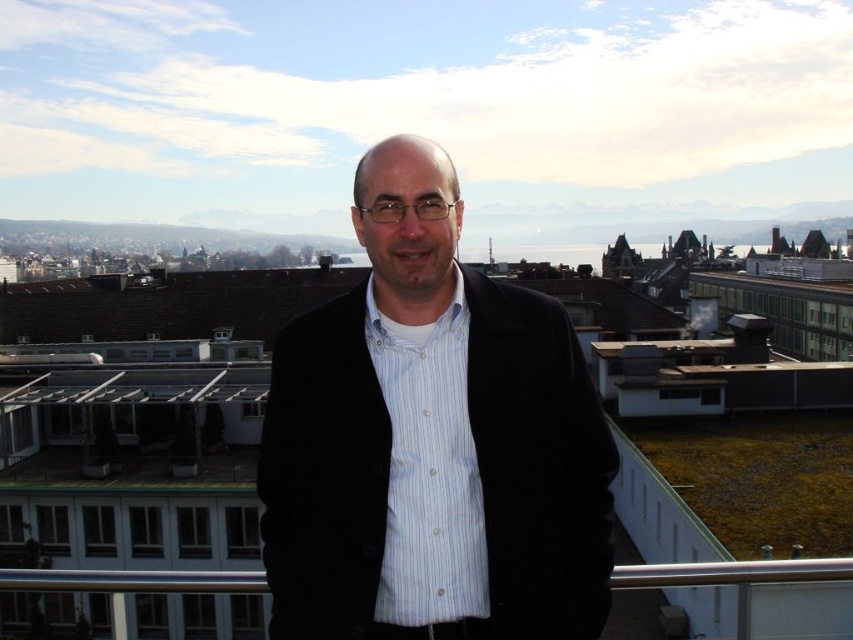
Which is below, white striped shirt at center or silver metallic rail at lower center?

Positioned lower is silver metallic rail at lower center.

Does point (389, 593) come closer to viewer compared to point (811, 563)?

That is True.

You are a GUI agent. You are given a task and a screenshot of the screen. Output one action in this format:
    pyautogui.click(x=<x>, y=<y>)
    Task: Click on the white striped shirt at center
    The image size is (853, 640).
    Given the screenshot: What is the action you would take?
    pyautogui.click(x=428, y=470)

Between black matte jacket at center and silver metallic rail at lower center, which one appears on the right side from the viewer's perspective?

From the viewer's perspective, black matte jacket at center appears more on the right side.

The image size is (853, 640). Find the location of `black matte jacket at center`. black matte jacket at center is located at coordinates (432, 442).

Image resolution: width=853 pixels, height=640 pixels. Identify the location of black matte jacket at center. (432, 442).

Can you confirm if black matte jacket at center is taller than white striped shirt at center?

Yes.

Which is below, black matte jacket at center or white striped shirt at center?

white striped shirt at center is lower down.

Is point (323, 380) behind point (438, 493)?

Yes, point (323, 380) is farther from viewer.

Image resolution: width=853 pixels, height=640 pixels. I want to click on black matte jacket at center, so click(432, 442).